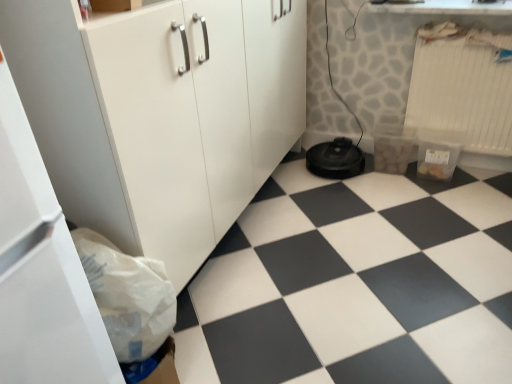
Question: Considering the relative positions of white paper bag at lower left and white plastic radiator at upper right in the image provided, is white paper bag at lower left to the left or to the right of white plastic radiator at upper right?

Choices:
 (A) right
 (B) left

Answer: (B)

Question: From their relative heights in the image, would you say white paper bag at lower left is taller or shorter than white plastic radiator at upper right?

Choices:
 (A) short
 (B) tall

Answer: (A)

Question: Which is farther from the white glossy countertop at upper center?

Choices:
 (A) white paper bag at lower left
 (B) white plastic radiator at upper right
 (C) black rubber vacuum cleaner at lower center
 (D) black plastic robot vacuum cleaner at lower center
 (E) white matte cabinet at lower left

Answer: (A)

Question: Estimate the real-world distances between objects in this image. Which object is farther from the black rubber vacuum cleaner at lower center?

Choices:
 (A) white paper bag at lower left
 (B) white plastic radiator at upper right
 (C) black plastic robot vacuum cleaner at lower center
 (D) white matte cabinet at lower left
 (E) white glossy countertop at upper center

Answer: (E)